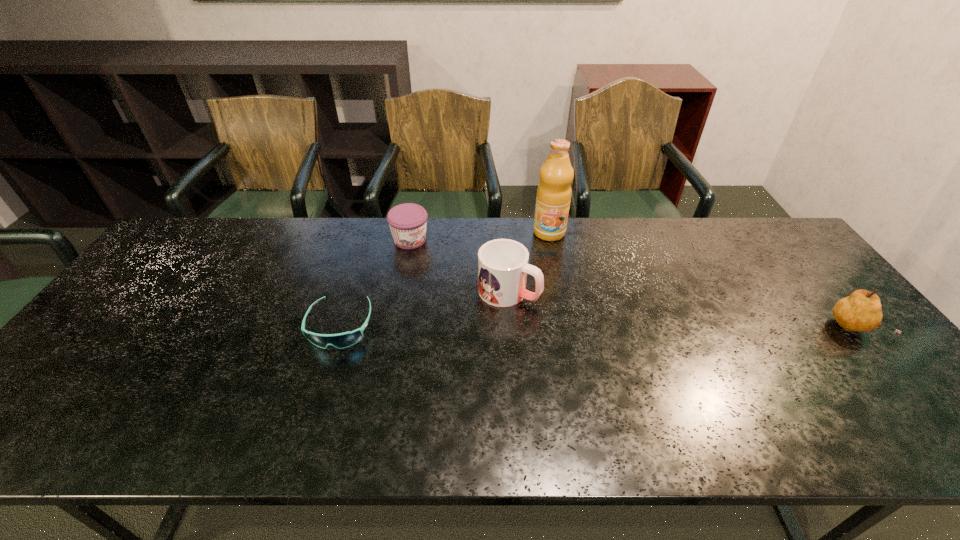
Locate an element on the screen. vacant space that's between the third object from right to left and the pear is located at coordinates (681, 310).

Locate an element on the screen. This screenshot has height=540, width=960. empty location between the pear and the fruit juice is located at coordinates (701, 281).

What are the coordinates of `empty location between the shortest object and the pear` in the screenshot? It's located at (596, 327).

This screenshot has height=540, width=960. Find the location of `free point between the fourth tallest object and the tallest object`. free point between the fourth tallest object and the tallest object is located at coordinates (480, 237).

Choose which object is the nearest neighbor to the shortest object. Please provide its 2D coordinates. Your answer should be formatted as a tuple, i.e. [(x, y)], where the tuple contains the x and y coordinates of a point satisfying the conditions above.

[(408, 221)]

This screenshot has width=960, height=540. What are the coordinates of `object that is the third closest one to the mug` in the screenshot? It's located at (342, 340).

I want to click on vacant region that satisfies the following two spatial constraints: 1. on the back side of the tallest object; 2. on the left side of the second shortest object, so click(x=412, y=233).